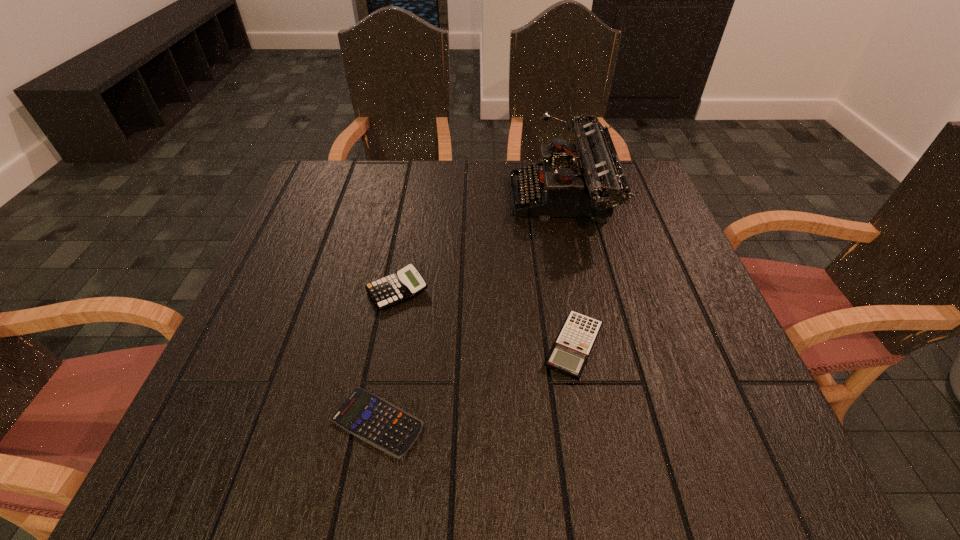
Where is `vacant region at the left edge of the desktop`? vacant region at the left edge of the desktop is located at coordinates (281, 329).

Identify the location of vacant space at the right edge of the desktop. This screenshot has height=540, width=960. (607, 228).

At what (x,y) coordinates should I click in order to perform the action: click on vacant position at the far left corner of the desktop. Please return your answer as a coordinate pair (x, y). Looking at the image, I should click on (323, 188).

Locate an element on the screen. free spot at the far right corner of the desktop is located at coordinates (639, 184).

Find the location of a particular element. The image size is (960, 540). empty location between the nearest object and the tallest calculator is located at coordinates (387, 356).

Identify the location of unoccupied position between the second farthest object and the third farthest object. tap(486, 319).

At what (x,y) coordinates should I click in order to perform the action: click on empty space between the second tallest object and the tallest object. Please return your answer as a coordinate pair (x, y). Image resolution: width=960 pixels, height=540 pixels. Looking at the image, I should click on (480, 246).

Locate an element on the screen. The width and height of the screenshot is (960, 540). vacant area between the farthest calculator and the nearest calculator is located at coordinates (387, 356).

Find the location of a particular element. This screenshot has height=540, width=960. unoccupied position between the typewriter and the shortest calculator is located at coordinates (469, 312).

Locate an element on the screen. This screenshot has width=960, height=540. vacant space in between the nearest calculator and the second nearest object is located at coordinates (475, 384).